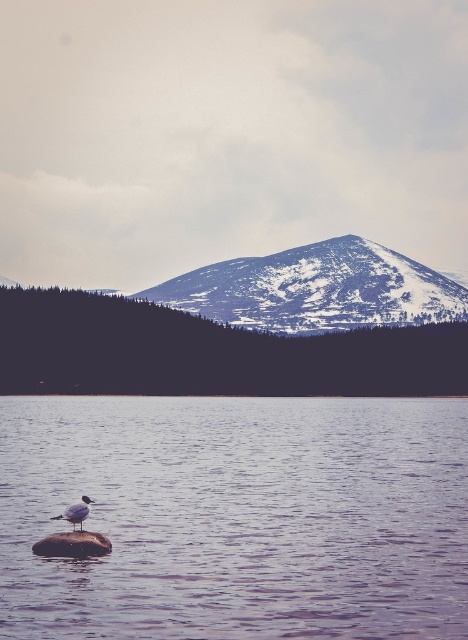
You are standing at the edge of the water and want to reach the smooth water at center. Given that the distance is 1132.43 feet, can you walk there in 10 minutes if your walking speed is 3 feet per second?

The distance between you and the smooth water at center is 1132.43 feet. At a walking speed of 3 feet per second, it would take approximately 377.48 seconds, which is about 6.29 minutes. Therefore, you can reach the smooth water at center within 10 minutes.

You are a photographer planning to capture the smooth water at center and the snowy rock formation at center in a single frame. Based on the scene, which object will occupy more horizontal space in your photo?

The smooth water at center will occupy more horizontal space in the photo because its width is larger than that of the snowy rock formation at center.